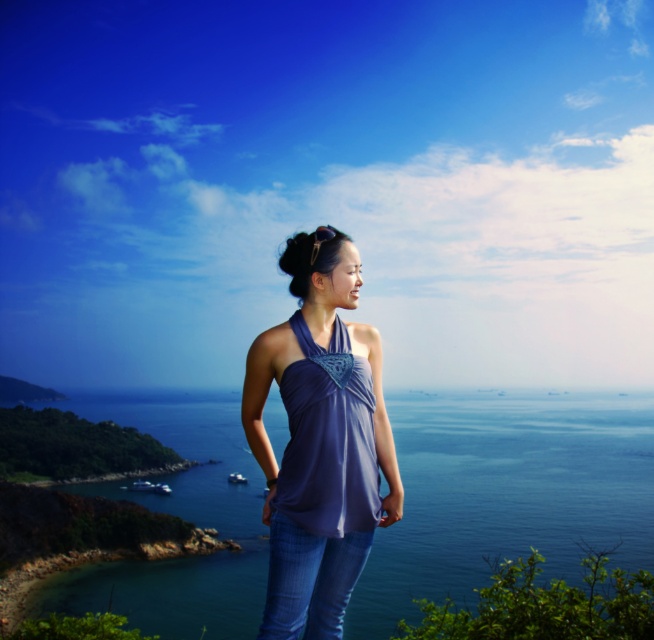
Between purple fabric top at center and blue denim jeans at center, which one appears on the left side from the viewer's perspective?

Positioned to the left is purple fabric top at center.

Does purple fabric top at center appear over blue denim jeans at center?

Yes, purple fabric top at center is above blue denim jeans at center.

Does point (290, 468) come farther from viewer compared to point (301, 593)?

Yes, it is.

Find the location of `purple fabric top at center`. purple fabric top at center is located at coordinates (320, 440).

Can you confirm if blue water at center is wider than blue denim jeans at center?

Yes, blue water at center is wider than blue denim jeans at center.

Which is behind, point (405, 497) or point (339, 604)?

The point (405, 497) is more distant.

Where is `blue water at center`? The image size is (654, 640). blue water at center is located at coordinates (506, 493).

Is blue water at center further to camera compared to purple fabric top at center?

Yes, blue water at center is further from the viewer.

Measure the distance between point [243,620] and camera.

They are 44.26 meters apart.

Is point (490, 481) farther from viewer compared to point (345, 595)?

Yes, it is.

Locate an element on the screen. The height and width of the screenshot is (640, 654). blue water at center is located at coordinates (506, 493).